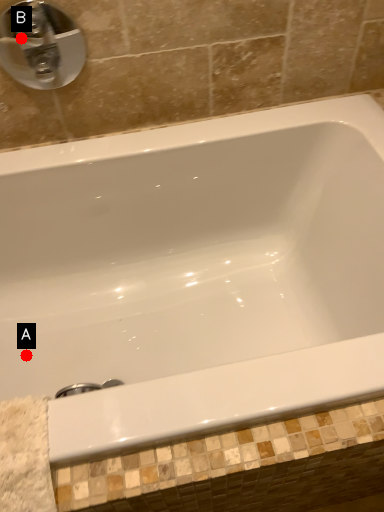
Question: Two points are circled on the image, labeled by A and B beside each circle. Which point is closer to the camera?

Choices:
 (A) A is closer
 (B) B is closer

Answer: (B)